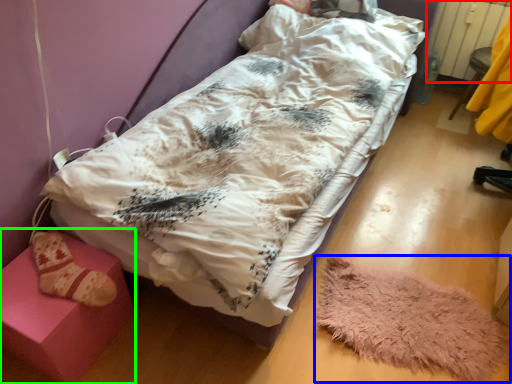
Question: Considering the real-world distances, which object is farthest from radiator (highlighted by a red box)? mat (highlighted by a blue box) or furniture (highlighted by a green box)?

Choices:
 (A) mat
 (B) furniture

Answer: (B)